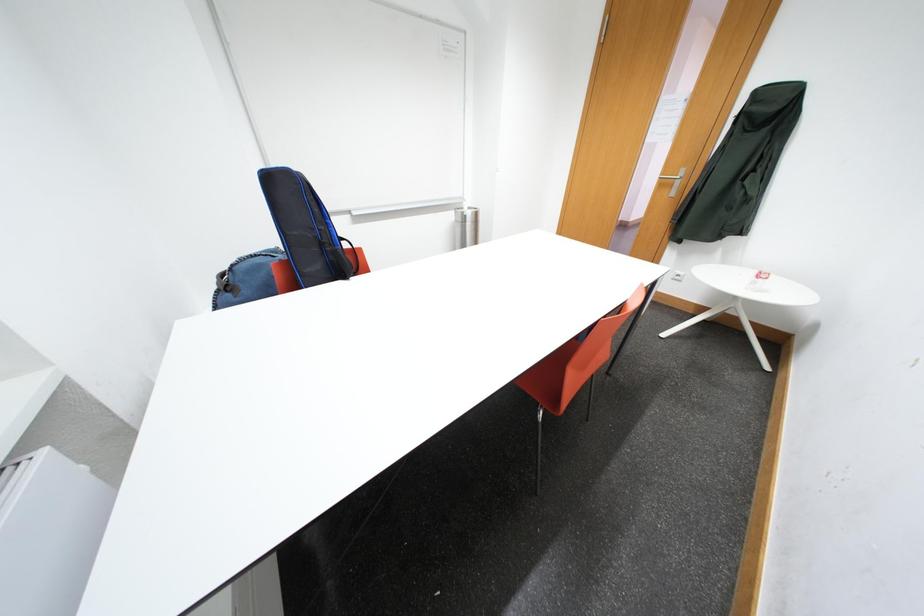
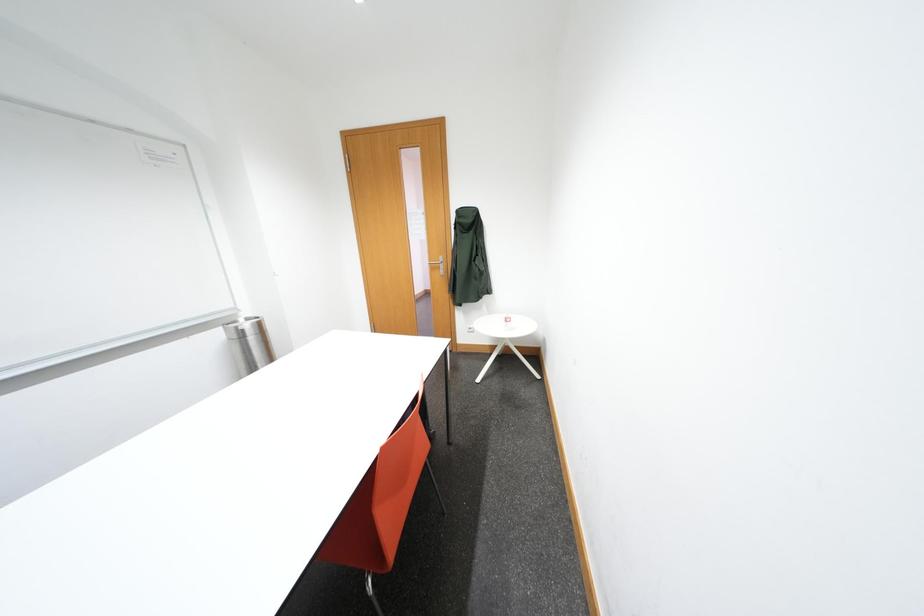
Question: The images are taken continuously from a first-person perspective. In which direction is your viewpoint rotating?

Choices:
 (A) Left
 (B) Right
 (C) Up
 (D) Down

Answer: (B)